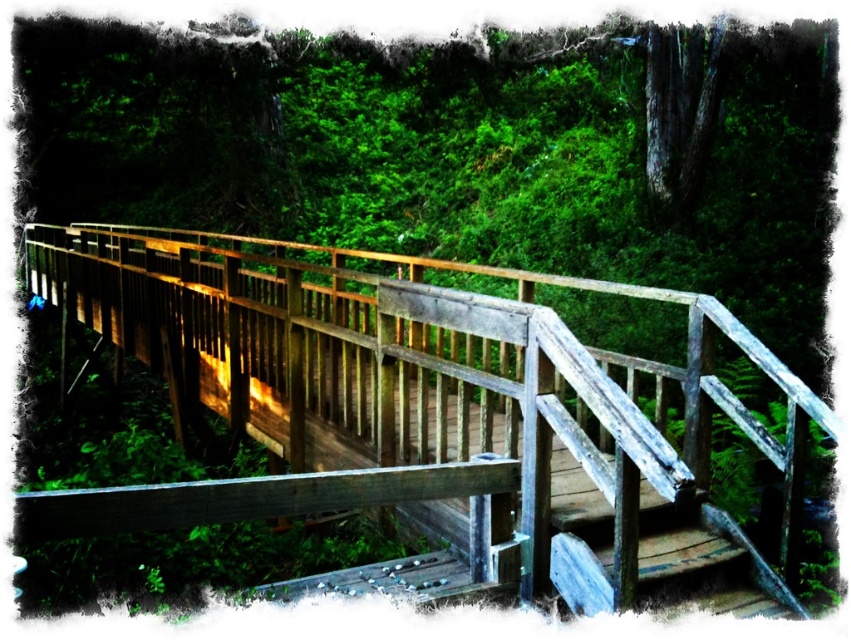
Is weathered wood bridge at center to the right of weathered wood stairs at center from the viewer's perspective?

Indeed, weathered wood bridge at center is positioned on the right side of weathered wood stairs at center.

Can you confirm if weathered wood bridge at center is smaller than weathered wood stairs at center?

Yes, weathered wood bridge at center is smaller than weathered wood stairs at center.

Is point (253, 416) closer to camera compared to point (643, 493)?

No, it is not.

Locate an element on the screen. This screenshot has height=640, width=851. weathered wood bridge at center is located at coordinates (430, 412).